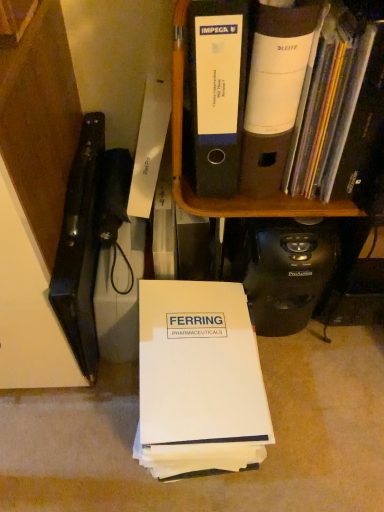
Question: In terms of size, does white paper at center, which ranks as the 1th book in left-to-right order, appear bigger or smaller than white matte folder at upper right, positioned as the first book in top-to-bottom order?

Choices:
 (A) big
 (B) small

Answer: (A)

Question: From a real-world perspective, is white paper at center, which appears as the 1th book when ordered from the bottom, above or below white matte folder at upper right, the second book ordered from the bottom?

Choices:
 (A) above
 (B) below

Answer: (B)

Question: Estimate the real-world distances between objects in this image. Which object is closer to the white matte folder at upper right, the second book ordered from the bottom?

Choices:
 (A) white paper at center, which ranks as the 1th book in left-to-right order
 (B) black plastic file folders at upper center

Answer: (B)

Question: Based on their relative distances, which object is farther from the white matte folder at upper right, positioned as the first book in top-to-bottom order?

Choices:
 (A) black plastic file folders at upper center
 (B) white paper at center, which appears as the 1th book when ordered from the bottom

Answer: (B)